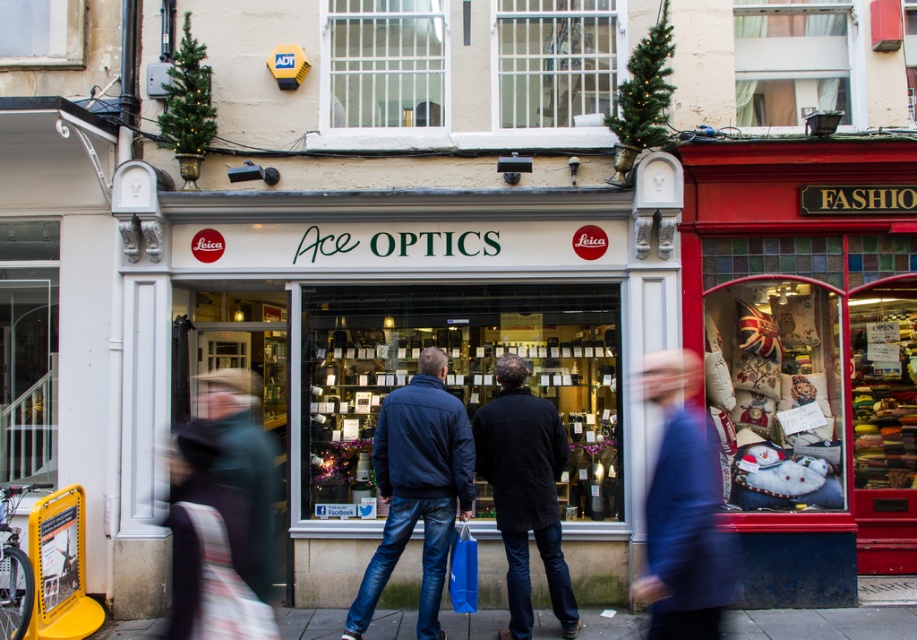
Question: Is blue woolen coat at center positioned behind smooth concrete sidewalk at center?

Choices:
 (A) no
 (B) yes

Answer: (A)

Question: Which point is closer to the camera taking this photo?

Choices:
 (A) (266, 611)
 (B) (447, 632)

Answer: (A)

Question: Which point appears closest to the camera in this image?

Choices:
 (A) (431, 628)
 (B) (191, 522)

Answer: (B)

Question: Does blue denim jeans at center come behind smooth concrete sidewalk at center?

Choices:
 (A) yes
 (B) no

Answer: (B)

Question: Which object is farther from the camera taking this photo?

Choices:
 (A) blue denim jeans at center
 (B) blue woolen coat at center
 (C) smooth concrete sidewalk at center

Answer: (C)

Question: Can you confirm if blue woolen coat at center is smaller than striped fabric coat at center?

Choices:
 (A) yes
 (B) no

Answer: (B)